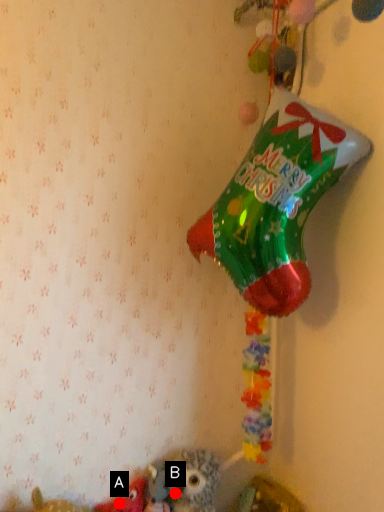
Question: Two points are circled on the image, labeled by A and B beside each circle. Which of the following is the closest to the observer?

Choices:
 (A) A is closer
 (B) B is closer

Answer: (A)